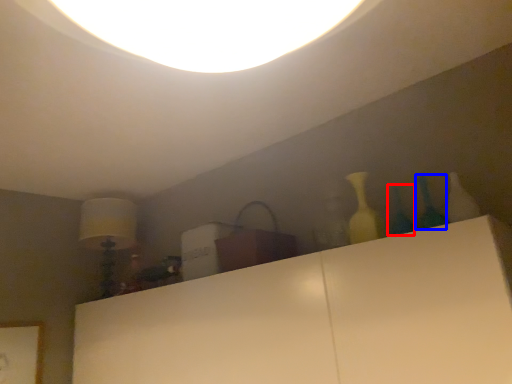
Question: Which object appears closest to the camera in this image, glass vase (highlighted by a red box) or glass vase (highlighted by a blue box)?

Choices:
 (A) glass vase
 (B) glass vase

Answer: (B)